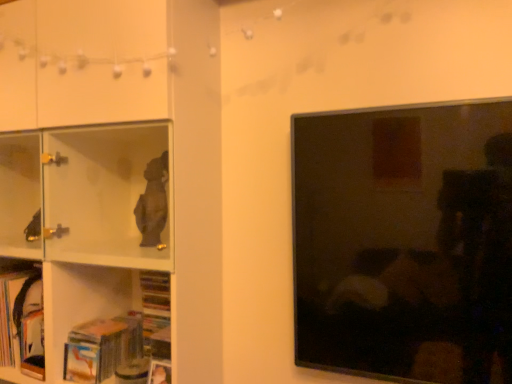
Where is `matte black tv at right`? The image size is (512, 384). matte black tv at right is located at coordinates click(x=405, y=242).

Measure the distance between point (198, 243) and camera.

They are 4.32 feet apart.

Describe the element at coordinates (177, 162) in the screenshot. I see `white glossy shelf at left` at that location.

Where is `hardcover book at lower left, which is the 2th book from right to left`? This screenshot has height=384, width=512. hardcover book at lower left, which is the 2th book from right to left is located at coordinates (22, 323).

From the image's perspective, is hardcover book at lower left, acting as the second book starting from the left, over matte black tv at right?

No, from the image's perspective, hardcover book at lower left, acting as the second book starting from the left, is not over matte black tv at right.

Does point (134, 356) come in front of point (327, 222)?

No, (134, 356) is behind (327, 222).

Between hardcover book at lower left, acting as the second book starting from the left, and matte black tv at right, which one is positioned behind?

hardcover book at lower left, acting as the second book starting from the left, is further from the camera.

From their relative heights in the image, would you say hardcover book at lower left, acting as the second book starting from the left, is taller or shorter than matte black tv at right?

Considering their sizes, hardcover book at lower left, acting as the second book starting from the left, has less height than matte black tv at right.

Where is `shelf behind the matte black tv at right`? This screenshot has height=384, width=512. shelf behind the matte black tv at right is located at coordinates (177, 162).

Considering the sizes of white glossy shelf at left and matte black tv at right in the image, is white glossy shelf at left bigger or smaller than matte black tv at right?

Considering their sizes, white glossy shelf at left takes up more space than matte black tv at right.

Measure the distance from white glossy shelf at left to matte black tv at right.

white glossy shelf at left is 20.61 inches away from matte black tv at right.

Which of these two, white glossy shelf at left or matte black tv at right, is thinner?

matte black tv at right is thinner.

Choose the correct answer: Is matte black tv at right inside white glossy shelf at left or outside it?

matte black tv at right is not enclosed by white glossy shelf at left.

Does matte black tv at right have a larger size compared to white glossy shelf at left?

Actually, matte black tv at right might be smaller than white glossy shelf at left.

Does matte black tv at right come in front of white glossy shelf at left?

Yes, matte black tv at right is in front of white glossy shelf at left.

From a real-world perspective, who is located higher, hardcover book at lower left, which is the 2th book from right to left, or hardcover book at lower left, positioned as the 1th book in right-to-left order?

hardcover book at lower left, which is the 2th book from right to left, from a real-world perspective.

Consider the image. What's the angular difference between hardcover book at lower left, which is the 2th book from right to left, and hardcover book at lower left, positioned as the 1th book in right-to-left order,'s facing directions?

0.262 degrees separate the facing orientations of hardcover book at lower left, which is the 2th book from right to left, and hardcover book at lower left, positioned as the 1th book in right-to-left order.

In the scene shown: Considering the positions of objects hardcover book at lower left, which is the 2th book from right to left, and hardcover book at lower left, positioned as the 1th book in right-to-left order, in the image provided, who is more to the left, hardcover book at lower left, which is the 2th book from right to left, or hardcover book at lower left, positioned as the 1th book in right-to-left order,?

Positioned to the left is hardcover book at lower left, which is the 2th book from right to left.

Based on the photo, considering the sizes of objects hardcover book at lower left, which is the 2th book from right to left, and hardcover book at lower left, acting as the second book starting from the left, in the image provided, who is smaller, hardcover book at lower left, which is the 2th book from right to left, or hardcover book at lower left, acting as the second book starting from the left,?

With smaller size is hardcover book at lower left, acting as the second book starting from the left.

Does hardcover book at lower left, acting as the second book starting from the left, have a lesser width compared to hardcover book at lower left, which is the 2th book from right to left?

In fact, hardcover book at lower left, acting as the second book starting from the left, might be wider than hardcover book at lower left, which is the 2th book from right to left.

From a real-world perspective, is hardcover book at lower left, positioned as the 1th book in right-to-left order, located beneath hardcover book at lower left, which is the 1th book from left to right?

Correct, in the physical world, hardcover book at lower left, positioned as the 1th book in right-to-left order, is lower than hardcover book at lower left, which is the 1th book from left to right.

Is hardcover book at lower left, positioned as the 1th book in right-to-left order, not inside hardcover book at lower left, which is the 1th book from left to right?

That's correct, hardcover book at lower left, positioned as the 1th book in right-to-left order, is outside of hardcover book at lower left, which is the 1th book from left to right.

In the scene shown: Is the position of hardcover book at lower left, positioned as the 1th book in right-to-left order, less distant than that of hardcover book at lower left, which is the 1th book from left to right?

Yes, it is.

Find the location of a particular element. This screenshot has width=512, height=384. book that is the 2nd object located behind the white glossy shelf at left is located at coordinates (22, 323).

From a real-world perspective, is hardcover book at lower left, which is the 1th book from left to right, over white glossy shelf at left?

Actually, hardcover book at lower left, which is the 1th book from left to right, is physically below white glossy shelf at left in the real world.

In terms of width, does hardcover book at lower left, which is the 1th book from left to right, look wider or thinner when compared to white glossy shelf at left?

Clearly, hardcover book at lower left, which is the 1th book from left to right, has less width compared to white glossy shelf at left.

Is white glossy shelf at left completely or partially inside hardcover book at lower left, which is the 1th book from left to right?

That's incorrect, white glossy shelf at left is not inside hardcover book at lower left, which is the 1th book from left to right.

From the image's perspective, would you say white glossy shelf at left is shown under hardcover book at lower left, positioned as the 1th book in right-to-left order?

Incorrect, from the image's perspective, white glossy shelf at left is higher than hardcover book at lower left, positioned as the 1th book in right-to-left order.

Looking at this image, is white glossy shelf at left at the left side of hardcover book at lower left, positioned as the 1th book in right-to-left order?

Correct, you'll find white glossy shelf at left to the left of hardcover book at lower left, positioned as the 1th book in right-to-left order.

Which point is more forward, (141, 101) or (73, 353)?

Positioned in front is point (141, 101).

Identify the location of the 2nd book positioned below the matte black tv at right (from a real-world perspective). This screenshot has width=512, height=384. (102, 348).

Where is `picture frame below the white glossy shelf at left (from the image's perspective)`? The height and width of the screenshot is (384, 512). picture frame below the white glossy shelf at left (from the image's perspective) is located at coordinates (405, 242).

Looking at the image, which one is located closer to white glossy shelf at left, hardcover book at lower left, which is the 2th book from right to left, or hardcover book at lower left, acting as the second book starting from the left?

Based on the image, hardcover book at lower left, acting as the second book starting from the left, appears to be nearer to white glossy shelf at left.

Which object lies nearer to the anchor point hardcover book at lower left, which is the 2th book from right to left, hardcover book at lower left, acting as the second book starting from the left, or white glossy shelf at left?

hardcover book at lower left, acting as the second book starting from the left, is positioned closer to the anchor hardcover book at lower left, which is the 2th book from right to left.

Based on their spatial positions, is white glossy shelf at left or hardcover book at lower left, acting as the second book starting from the left, closer to hardcover book at lower left, which is the 2th book from right to left?

Based on the image, hardcover book at lower left, acting as the second book starting from the left, appears to be nearer to hardcover book at lower left, which is the 2th book from right to left.

Considering their positions, is hardcover book at lower left, which is the 2th book from right to left, positioned further to matte black tv at right than hardcover book at lower left, positioned as the 1th book in right-to-left order?

Based on the image, hardcover book at lower left, which is the 2th book from right to left, appears to be further to matte black tv at right.

Which object lies nearer to the anchor point matte black tv at right, white glossy shelf at left or hardcover book at lower left, positioned as the 1th book in right-to-left order?

white glossy shelf at left.

When comparing their distances from hardcover book at lower left, which is the 1th book from left to right, does white glossy shelf at left or matte black tv at right seem further?

matte black tv at right lies further to hardcover book at lower left, which is the 1th book from left to right, than the other object.

Estimate the real-world distances between objects in this image. Which object is closer to matte black tv at right, hardcover book at lower left, positioned as the 1th book in right-to-left order, or hardcover book at lower left, which is the 2th book from right to left?

Among the two, hardcover book at lower left, positioned as the 1th book in right-to-left order, is located nearer to matte black tv at right.

Estimate the real-world distances between objects in this image. Which object is closer to matte black tv at right, hardcover book at lower left, which is the 1th book from left to right, or white glossy shelf at left?

The object closer to matte black tv at right is white glossy shelf at left.

I want to click on book between hardcover book at lower left, which is the 2th book from right to left, and matte black tv at right, so click(102, 348).

This screenshot has height=384, width=512. In order to click on book between white glossy shelf at left and matte black tv at right in the horizontal direction in this screenshot , I will do `click(102, 348)`.

Locate an element on the screen. The height and width of the screenshot is (384, 512). shelf located between hardcover book at lower left, which is the 2th book from right to left, and matte black tv at right in the left-right direction is located at coordinates (177, 162).

Where is `book between white glossy shelf at left and hardcover book at lower left, acting as the second book starting from the left, in the up-down direction`? Image resolution: width=512 pixels, height=384 pixels. book between white glossy shelf at left and hardcover book at lower left, acting as the second book starting from the left, in the up-down direction is located at coordinates (22, 323).